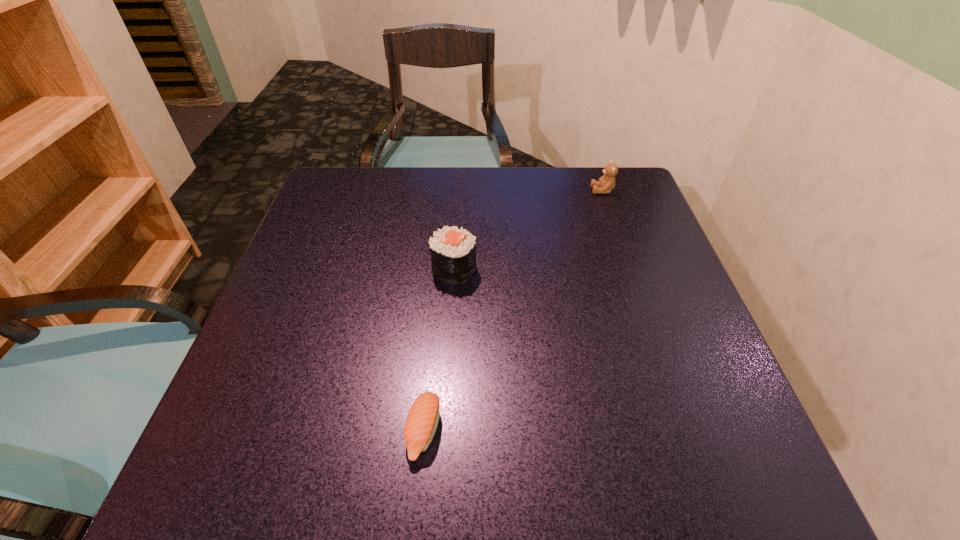
I want to click on vacant region located 0.100m on the back of the shortest object, so click(431, 352).

Locate an element on the screen. The image size is (960, 540). object that is at the far edge is located at coordinates (606, 183).

Identify the location of object that is at the near edge. This screenshot has height=540, width=960. (422, 420).

You are a GUI agent. You are given a task and a screenshot of the screen. Output one action in this format:
    pyautogui.click(x=<x>, y=<y>)
    Task: Click on the object that is positioned at the right edge
    The image size is (960, 540).
    Given the screenshot: What is the action you would take?
    pyautogui.click(x=606, y=183)

Where is `object that is positioned at the far right corner`? object that is positioned at the far right corner is located at coordinates (606, 183).

I want to click on free location at the far edge of the desktop, so (x=567, y=208).

Where is `vacant point at the near edge`? The image size is (960, 540). vacant point at the near edge is located at coordinates (424, 487).

The height and width of the screenshot is (540, 960). I want to click on vacant space at the left edge of the desktop, so click(x=335, y=323).

In the image, there is a desktop. Identify the location of free space at the right edge. (619, 246).

Image resolution: width=960 pixels, height=540 pixels. What are the coordinates of `vacant space at the far left corner of the desktop` in the screenshot? It's located at (346, 204).